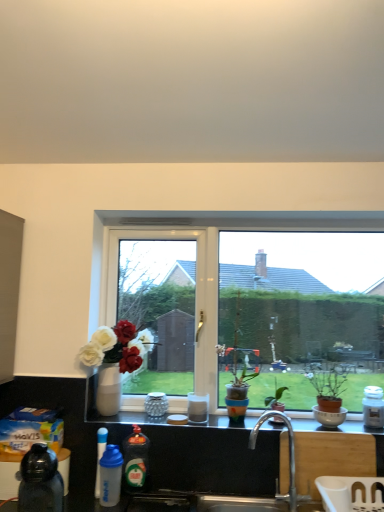
Where is `free point above black matte window sill at lower center (from a real-world perspective)`? free point above black matte window sill at lower center (from a real-world perspective) is located at coordinates (256, 425).